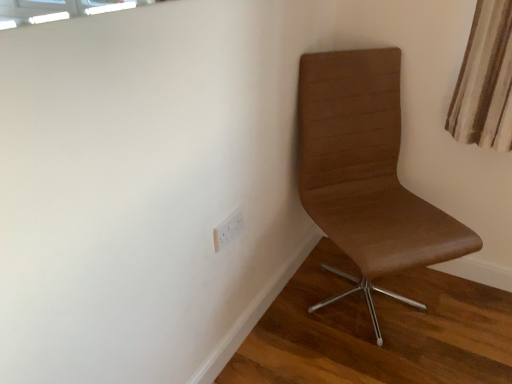
Question: Is white plastic electric outlet at lower center situated inside brown leather chair at right or outside?

Choices:
 (A) outside
 (B) inside

Answer: (A)

Question: Is point 217,241 closer or farther from the camera than point 316,195?

Choices:
 (A) closer
 (B) farther

Answer: (A)

Question: From their relative heights in the image, would you say white plastic electric outlet at lower center is taller or shorter than brown leather chair at right?

Choices:
 (A) short
 (B) tall

Answer: (A)

Question: Would you say brown leather chair at right is inside or outside white plastic electric outlet at lower center?

Choices:
 (A) outside
 (B) inside

Answer: (A)

Question: In terms of width, does brown leather chair at right look wider or thinner when compared to white plastic electric outlet at lower center?

Choices:
 (A) thin
 (B) wide

Answer: (B)

Question: Is brown leather chair at right taller or shorter than white plastic electric outlet at lower center?

Choices:
 (A) tall
 (B) short

Answer: (A)

Question: From the image's perspective, is brown leather chair at right located above or below white plastic electric outlet at lower center?

Choices:
 (A) below
 (B) above

Answer: (B)